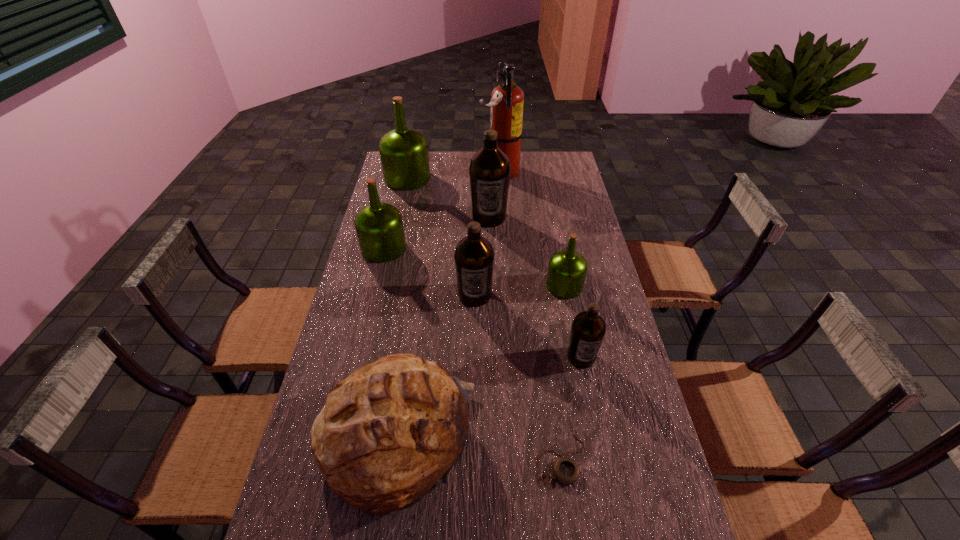
The width and height of the screenshot is (960, 540). Find the location of `empty space that is in between the biggest green olive oil and the second farthest brown olive oil`. empty space that is in between the biggest green olive oil and the second farthest brown olive oil is located at coordinates [442, 237].

Point out which object is positioned as the seventh nearest to the red fire extinguisher. Please provide its 2D coordinates. Your answer should be formatted as a tuple, i.e. [(x, y)], where the tuple contains the x and y coordinates of a point satisfying the conditions above.

[(389, 433)]

Find the location of a particular element. The height and width of the screenshot is (540, 960). the sixth closest object to the farthest green olive oil is located at coordinates (389, 433).

I want to click on the second closest olive oil to the red fire extinguisher, so click(404, 155).

The height and width of the screenshot is (540, 960). In order to click on olive oil that stands as the fourth closest to the red fire extinguisher in this screenshot , I will do `click(567, 269)`.

Locate an element on the screen. The height and width of the screenshot is (540, 960). green olive oil that is the closest to the nearest green olive oil is located at coordinates (379, 226).

The height and width of the screenshot is (540, 960). I want to click on green olive oil that can be found as the closest to the shortest object, so click(x=567, y=269).

You are a GUI agent. You are given a task and a screenshot of the screen. Output one action in this format:
    pyautogui.click(x=<x>, y=<y>)
    Task: Click on the brown olive oil that is the third closest to the farthest olive oil
    
    Given the screenshot: What is the action you would take?
    pyautogui.click(x=588, y=328)

Image resolution: width=960 pixels, height=540 pixels. Identify the location of brown olive oil that stands as the closest to the farthest olive oil. (489, 170).

The image size is (960, 540). What are the coordinates of `free space that satisfies the following two spatial constraints: 1. on the label of the pocket watch; 2. on the left side of the second biggest brown olive oil` in the screenshot? It's located at (473, 459).